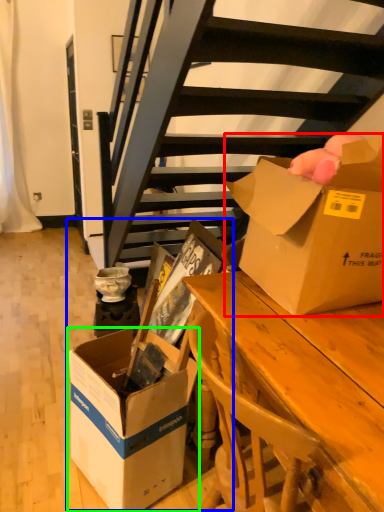
Question: Considering the real-world distances, which object is farthest from box (highlighted by a red box)? storage box (highlighted by a blue box) or box (highlighted by a green box)?

Choices:
 (A) storage box
 (B) box

Answer: (B)